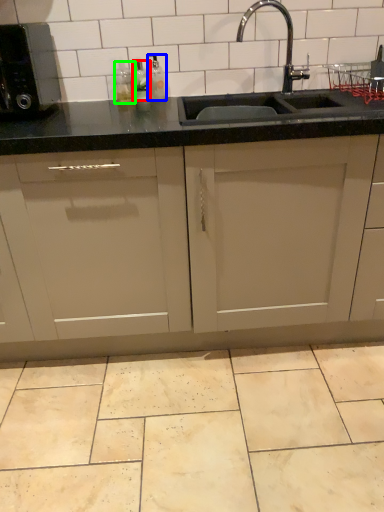
Question: Considering the real-world distances, which object is farthest from bottle (highlighted by a red box)? bottle (highlighted by a blue box) or bottle (highlighted by a green box)?

Choices:
 (A) bottle
 (B) bottle

Answer: (A)